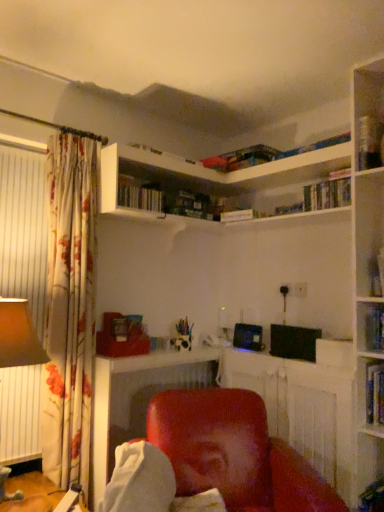
Question: From a real-world perspective, is matte red chair at center over matte red chair at lower center?

Choices:
 (A) yes
 (B) no

Answer: (B)

Question: Is matte red chair at center not near matte red chair at lower center?

Choices:
 (A) yes
 (B) no

Answer: (B)

Question: Can matte red chair at lower center be found inside matte red chair at center?

Choices:
 (A) no
 (B) yes

Answer: (A)

Question: Considering the relative positions of matte red chair at center and matte red chair at lower center in the image provided, is matte red chair at center to the right of matte red chair at lower center from the viewer's perspective?

Choices:
 (A) yes
 (B) no

Answer: (A)

Question: Can you confirm if matte red chair at center is positioned to the left of matte red chair at lower center?

Choices:
 (A) no
 (B) yes

Answer: (A)

Question: Looking at the image, does matte red chair at lower center seem bigger or smaller compared to hardcover book at upper center, which ranks as the second book in bottom-to-top order?

Choices:
 (A) big
 (B) small

Answer: (A)

Question: Considering the positions of point (105, 398) and point (127, 197), is point (105, 398) closer or farther from the camera than point (127, 197)?

Choices:
 (A) farther
 (B) closer

Answer: (B)

Question: Is matte red chair at lower center to the left or to the right of hardcover book at upper center, the 1th book when ordered from left to right, in the image?

Choices:
 (A) right
 (B) left

Answer: (A)

Question: In the image, is matte red chair at lower center positioned in front of or behind hardcover book at upper center, the 4th book viewed from the right?

Choices:
 (A) front
 (B) behind

Answer: (B)

Question: From a real-world perspective, is matte red chair at center physically located above or below hardcover book at upper right, the second book when ordered from top to bottom?

Choices:
 (A) above
 (B) below

Answer: (B)

Question: From the image's perspective, is matte red chair at center above or below hardcover book at upper right, positioned as the 3th book in bottom-to-top order?

Choices:
 (A) above
 (B) below

Answer: (B)

Question: Visually, is matte red chair at center positioned to the left or to the right of hardcover book at upper right, the second book positioned from the left?

Choices:
 (A) left
 (B) right

Answer: (A)

Question: Is point (258, 487) closer or farther from the camera than point (349, 198)?

Choices:
 (A) farther
 (B) closer

Answer: (B)

Question: Is hardcover book at upper right, the fourth book when ordered from top to bottom, inside or outside of hardcover book at upper right, the third book from the left?

Choices:
 (A) inside
 (B) outside

Answer: (B)

Question: Based on their positions, is hardcover book at upper right, the fourth book when ordered from top to bottom, located to the left or right of hardcover book at upper right, the second book in the right-to-left sequence?

Choices:
 (A) right
 (B) left

Answer: (A)